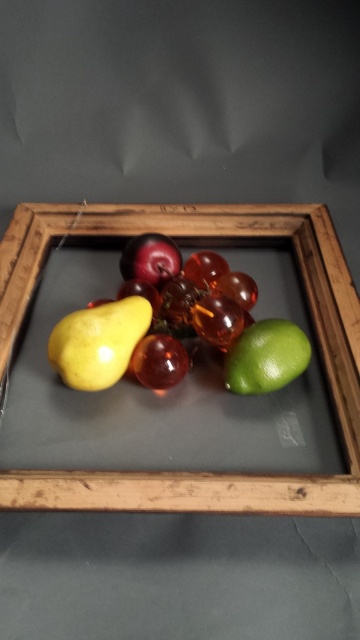
Is green matte lime at lower right behind shiny dark red plum at center?

No, it is in front of shiny dark red plum at center.

Does green matte lime at lower right appear on the right side of shiny dark red plum at center?

Indeed, green matte lime at lower right is positioned on the right side of shiny dark red plum at center.

Which is in front, point (237, 387) or point (181, 356)?

Positioned in front is point (237, 387).

The image size is (360, 640). In order to click on green matte lime at lower right in this screenshot , I will do `click(266, 356)`.

Between matte glass tray at center and yellow matte pear at center-left, which one appears on the right side from the viewer's perspective?

matte glass tray at center is more to the right.

Does matte glass tray at center appear under yellow matte pear at center-left?

Actually, matte glass tray at center is above yellow matte pear at center-left.

Find the location of a particular element. The height and width of the screenshot is (640, 360). matte glass tray at center is located at coordinates pyautogui.click(x=210, y=243).

Which of these two, matte glass tray at center or shiny red apple at center, stands shorter?

shiny red apple at center

Is point (353, 396) farther from viewer compared to point (153, 275)?

No.

The width and height of the screenshot is (360, 640). What are the coordinates of `matte glass tray at center` in the screenshot? It's located at (210, 243).